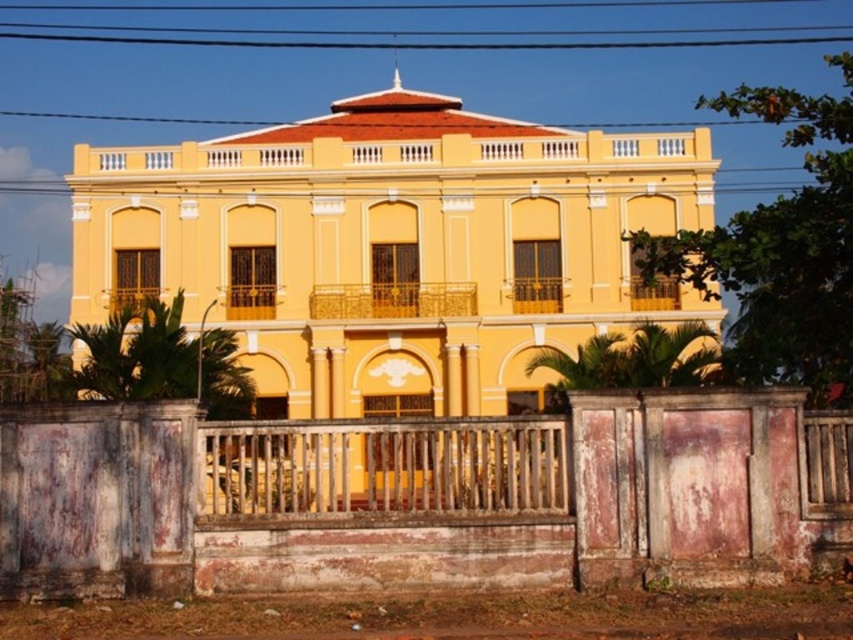
You are a delivery person trying to enter the property. You see the rusty wooden fence at center and the black wire at upper center. Which object is closer to the ground?

The rusty wooden fence at center is closer to the ground because it is below the black wire at upper center.

You are a painter hired to assess the building facade. You notice the rusty wooden fence at center and the black wire at upper center. Which object is taller?

The rusty wooden fence at center is taller than the black wire at upper center.

You are a painter hired to paint the wooden at center and the black wire at upper center. Which object requires more paint because it is larger?

The wooden at center requires more paint because it is bigger than the black wire at upper center.